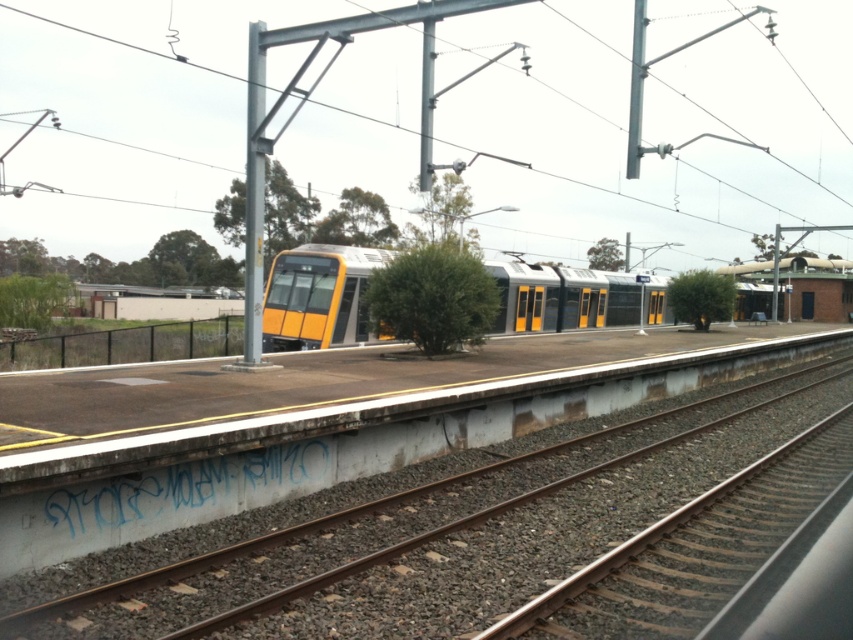
You are a maintenance worker who needs to reach the yellow matte train at center from the smooth concrete track at center. The safety regulations state that the minimum safe distance between a worker and a train should be at least 10 meters. Can you safely approach the train from the track?

The distance between the smooth concrete track at center and the yellow matte train at center is 8.91 meters, which is less than the required 10 meters safety distance. Therefore, you cannot safely approach the train from the track.

You are a maintenance worker standing on the platform and need to inspect the metallic gray power line at upper center. Given that your longest inspection tool is 50 meters, can you reach it with your current equipment?

The metallic gray power line at upper center is 86.20 meters away from the viewer, which exceeds the 50 meters reach of your inspection tool. Therefore, you cannot reach it with your current equipment.

You are standing at the railway station platform and want to reach a specific point marked as point (799, 10). Given that the distance between you and this point is 431.50 feet, can you estimate whether this point is located far from your current position?

The distance between you and point (799, 10) is 431.50 feet, which is quite far, so yes, the point is located far from your current position.